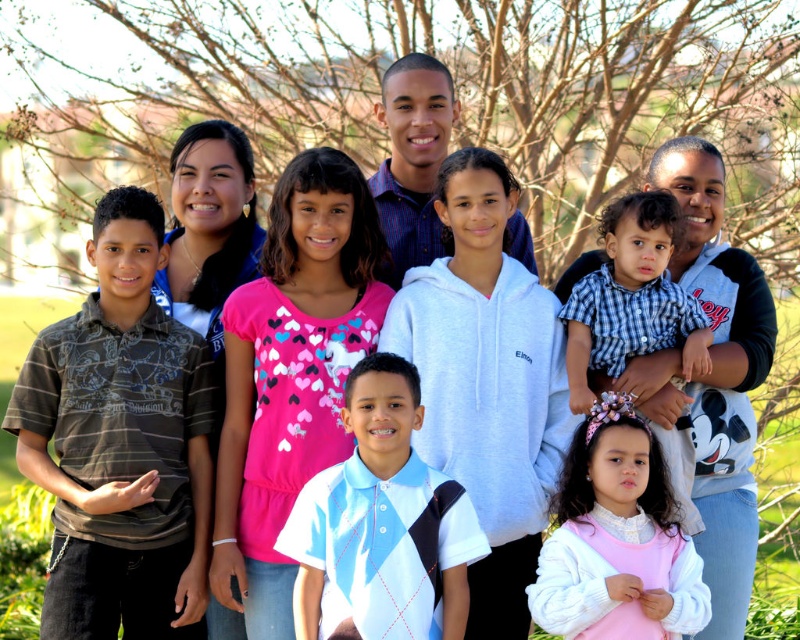
You are a photographer trying to capture a group photo of the children. You notice the white fleece hoodie at upper right and the pink velvet dress at lower right. Which child should you ask to stand on a small stool to ensure both are visible in the photo?

The white fleece hoodie at upper right is shorter than the pink velvet dress at lower right, so the child wearing the white fleece hoodie at upper right should stand on a stool to be seen.